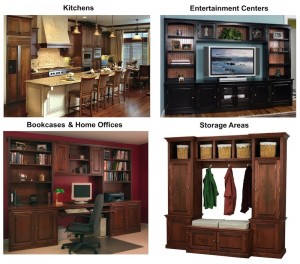
The height and width of the screenshot is (264, 300). What are the coordinates of `computer monitor` in the screenshot? It's located at (83, 192).